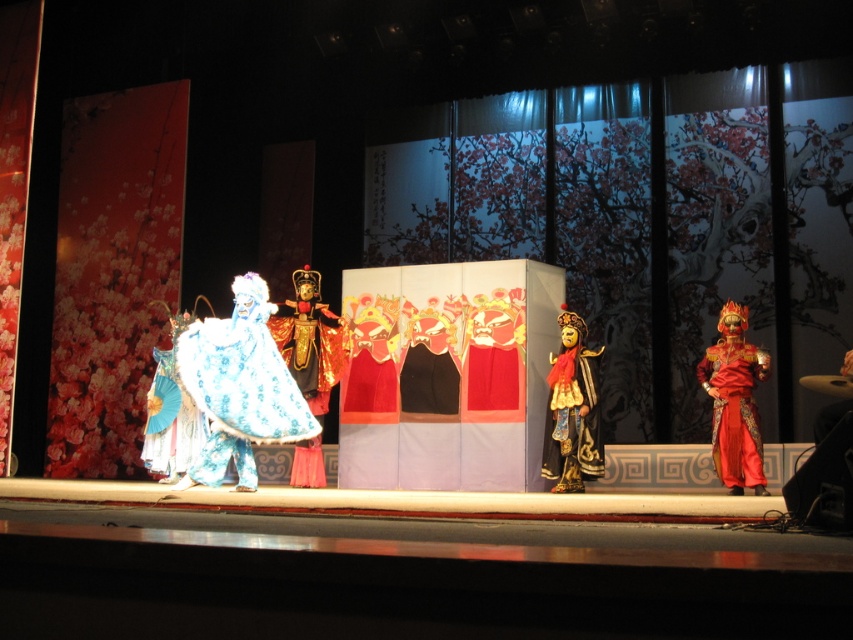
Question: Is blue satin robe at center to the right of shiny red costume at right from the viewer's perspective?

Choices:
 (A) yes
 (B) no

Answer: (B)

Question: Is shiny red costume at right to the left of gold textured mask at center from the viewer's perspective?

Choices:
 (A) yes
 (B) no

Answer: (B)

Question: Which object is positioned farthest from the blue satin robe at center?

Choices:
 (A) gold textured mask at center
 (B) shiny red costume at right
 (C) gold metallic mask at center
 (D) shiny blue fabric at center

Answer: (B)

Question: Which point is farther to the camera?

Choices:
 (A) gold textured mask at center
 (B) blue satin robe at center
 (C) shiny blue fabric at center
 (D) gold metallic mask at center

Answer: (C)

Question: Which object is positioned closest to the blue satin robe at center?

Choices:
 (A) shiny blue fabric at center
 (B) shiny red costume at right
 (C) gold textured mask at center
 (D) gold metallic mask at center

Answer: (C)

Question: Does blue satin robe at center have a larger size compared to gold textured mask at center?

Choices:
 (A) yes
 (B) no

Answer: (A)